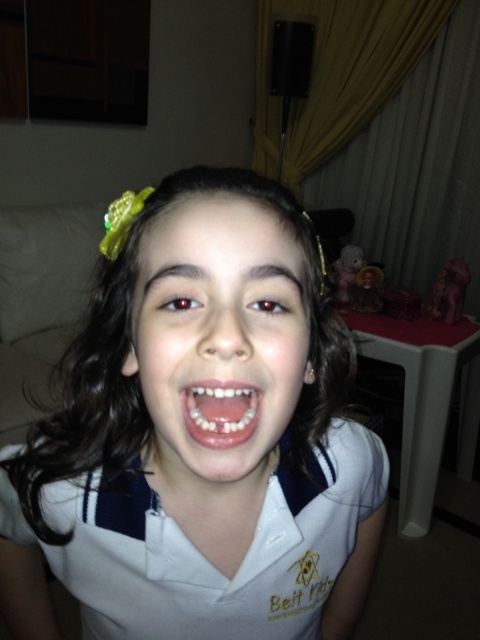
You are a photographer adjusting your camera settings. You notice the white glossy shirt at center and the smooth skin face at center in the frame. Which object is positioned nearer to your camera lens?

The white glossy shirt at center is closer to the viewer than the smooth skin face at center, so the white glossy shirt at center is nearer to the camera lens.

You are a photographer adjusting the lighting for a portrait of the girl in the image. You need to ensure that both the smooth skin face at center and the white glossy teeth at center are well illuminated. Given their sizes, which one might require more focused lighting to avoid being overshadowed?

The smooth skin face at center is taller than the white glossy teeth at center, so the smaller white glossy teeth at center might need more focused lighting to ensure they are properly illuminated and not overshadowed by the larger face area.

You are standing in the living room and need to find the white glossy shirt at center. According to the coordinates provided in the description, where exactly should you look to locate it?

The white glossy shirt at center is located at point (x=194, y=440), so you should look towards the lower right area of the image to find it.